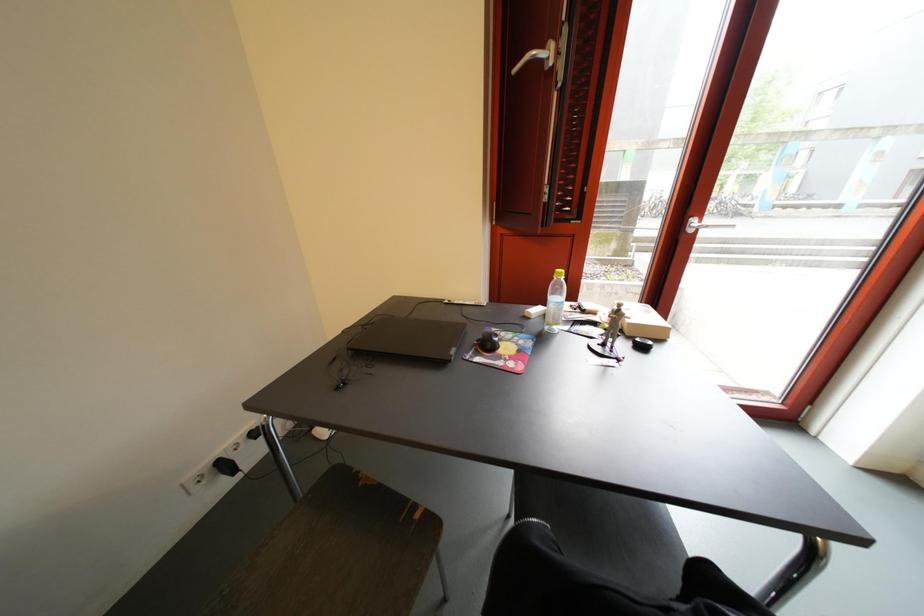
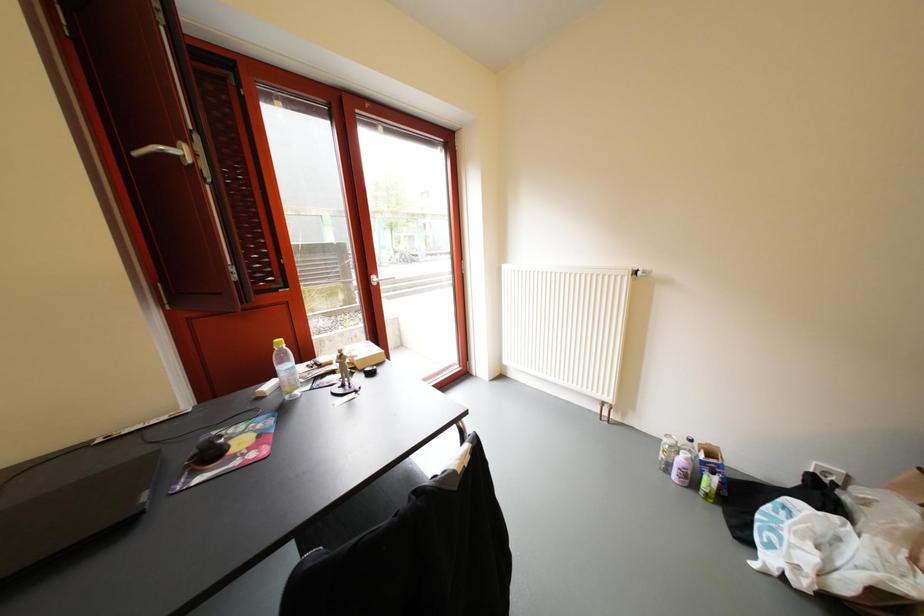
Question: How did the camera likely rotate?

Choices:
 (A) Left
 (B) Right
 (C) Up
 (D) Down

Answer: (B)